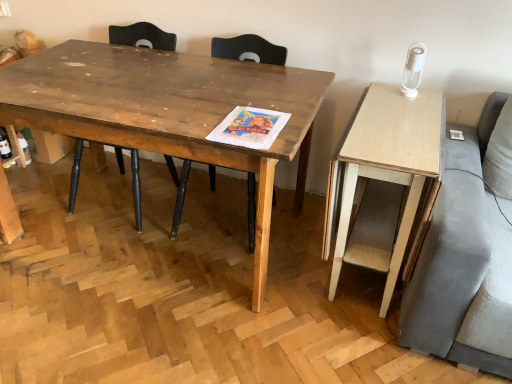
At what (x,y) coordinates should I click in order to perform the action: click on space that is in front of wooden table at center. Please return your answer as a coordinate pair (x, y). Image resolution: width=512 pixels, height=384 pixels. Looking at the image, I should click on (139, 327).